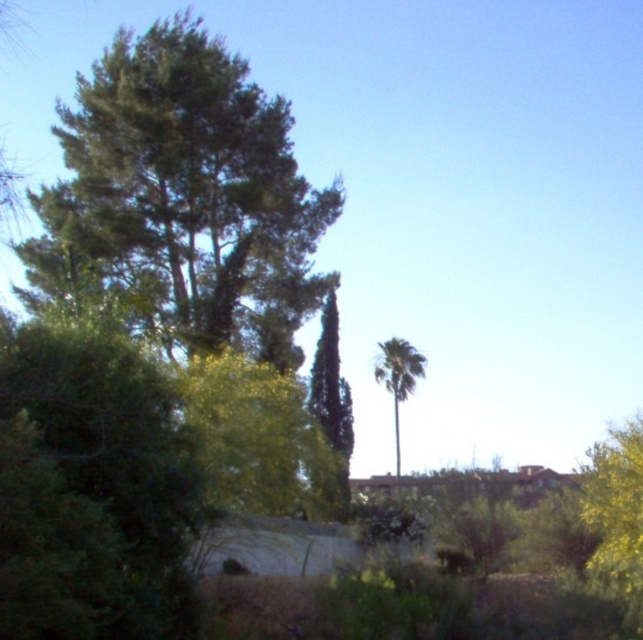
Which of these two, green leafy tree at upper left or green leafy bush at right, stands taller?

green leafy tree at upper left is taller.

Can you confirm if green leafy tree at upper left is wider than green leafy bush at right?

Yes.

What do you see at coordinates (185, 195) in the screenshot?
I see `green leafy tree at upper left` at bounding box center [185, 195].

I want to click on green leafy tree at upper left, so click(185, 195).

Does green leafy tree at upper left appear on the left side of green leafy palm at center?

Yes, green leafy tree at upper left is to the left of green leafy palm at center.

The image size is (643, 640). What do you see at coordinates (185, 195) in the screenshot? I see `green leafy tree at upper left` at bounding box center [185, 195].

What are the coordinates of `green leafy tree at upper left` in the screenshot? It's located at (185, 195).

Where is `green leafy bush at right`? The width and height of the screenshot is (643, 640). green leafy bush at right is located at coordinates (617, 515).

Does green leafy bush at right have a lesser width compared to green leafy palm at center?

Yes, green leafy bush at right is thinner than green leafy palm at center.

Which is in front, point (597, 577) or point (397, 413)?

Point (597, 577) is in front.

I want to click on green leafy bush at right, so click(617, 515).